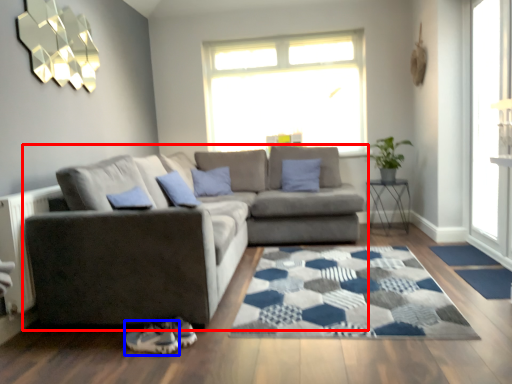
Question: Among these objects, which one is farthest to the camera, studio couch (highlighted by a red box) or shoe (highlighted by a blue box)?

Choices:
 (A) studio couch
 (B) shoe

Answer: (A)